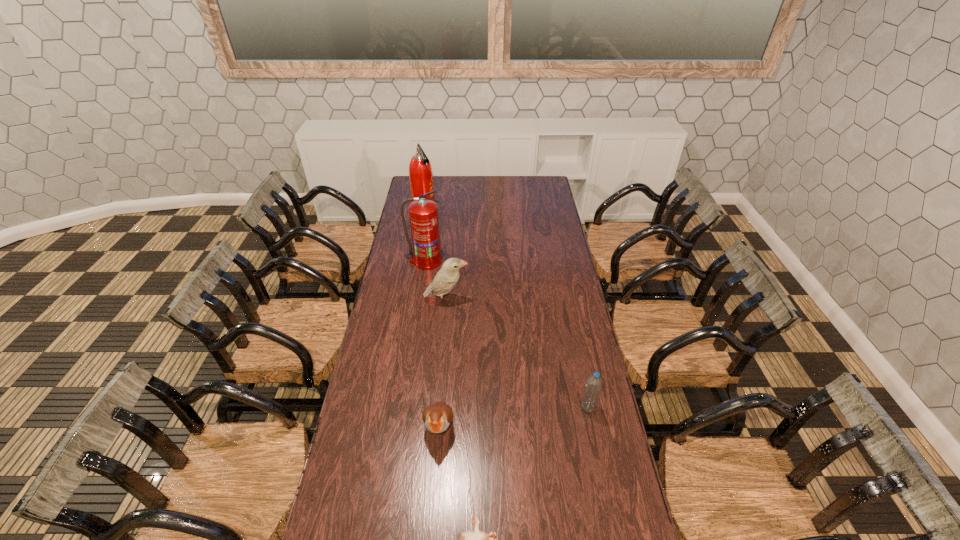
Find the location of `the farther fire extinguisher`. the farther fire extinguisher is located at coordinates (420, 171).

Locate an element on the screen. The image size is (960, 540). the nearer fire extinguisher is located at coordinates (423, 213).

Locate an element on the screen. The width and height of the screenshot is (960, 540). the fourth nearest object is located at coordinates (447, 277).

Locate an element on the screen. This screenshot has height=540, width=960. the tallest bird is located at coordinates (447, 277).

Locate an element on the screen. the third shortest object is located at coordinates (592, 390).

You are a GUI agent. You are given a task and a screenshot of the screen. Output one action in this format:
    pyautogui.click(x=<x>, y=<y>)
    Task: Click on the water bottle
    This screenshot has width=960, height=540.
    Given the screenshot: What is the action you would take?
    pyautogui.click(x=592, y=390)

Identify the location of the second farthest bird. The width and height of the screenshot is (960, 540). (437, 417).

Find the location of `vacant space located 0.070m on the back of the farthest object`. vacant space located 0.070m on the back of the farthest object is located at coordinates tap(427, 200).

What are the coordinates of `free region located on the instruction side of the nearer fire extinguisher` in the screenshot? It's located at (419, 314).

Image resolution: width=960 pixels, height=540 pixels. Identify the location of free region located 0.300m at the face of the farthest bird. (536, 300).